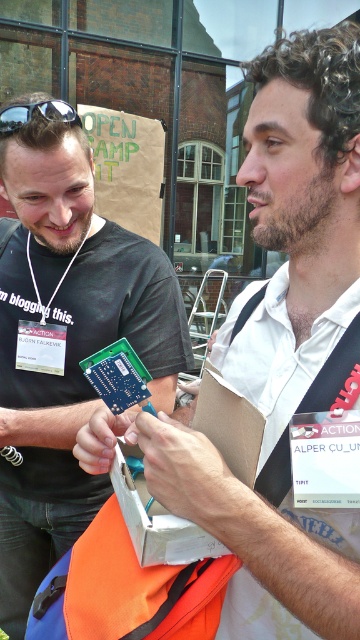
You are a photographer at the event and want to capture a closeup of the matte black shirt at upper left and the black plastic goggles at upper left. Which object should you focus on first if you want to ensure both are in focus without adjusting the camera focus?

The matte black shirt at upper left has a greater height compared to black plastic goggles at upper left, so focusing on the matte black shirt at upper left first will ensure both are in focus since it is taller and farther away.

Looking at the scene, where is the matte black shirt at upper left in relation to the black plastic goggles at upper left?

The matte black shirt at upper left is to the right of the black plastic goggles at upper left.